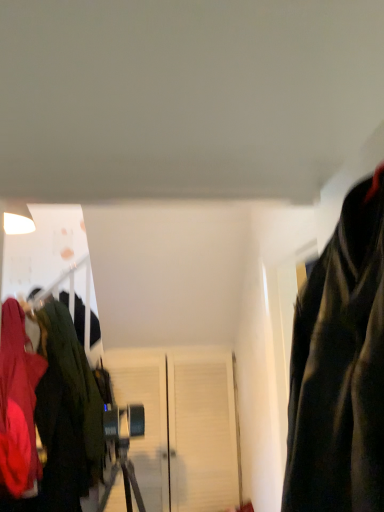
Question: From a real-world perspective, is velvet green jacket at left, which is counted as the first jacket, starting from the back, under white matte door at center?

Choices:
 (A) yes
 (B) no

Answer: (B)

Question: Considering the relative positions of velvet green jacket at left, the second jacket when ordered from front to back, and white matte door at center in the image provided, is velvet green jacket at left, the second jacket when ordered from front to back, to the left of white matte door at center from the viewer's perspective?

Choices:
 (A) no
 (B) yes

Answer: (B)

Question: Considering the relative sizes of velvet green jacket at left, which is counted as the first jacket, starting from the back, and white matte door at center in the image provided, is velvet green jacket at left, which is counted as the first jacket, starting from the back, wider than white matte door at center?

Choices:
 (A) yes
 (B) no

Answer: (A)

Question: Does velvet green jacket at left, the second jacket when ordered from front to back, have a lesser height compared to white matte door at center?

Choices:
 (A) no
 (B) yes

Answer: (A)

Question: Does velvet green jacket at left, the second jacket when ordered from front to back, come behind white matte door at center?

Choices:
 (A) no
 (B) yes

Answer: (A)

Question: In terms of height, does white matte door at center look taller or shorter compared to velvet green jacket at left, which is counted as the first jacket, starting from the back?

Choices:
 (A) tall
 (B) short

Answer: (B)

Question: Would you say white matte door at center is to the left or to the right of velvet green jacket at left, the second jacket when ordered from front to back, in the picture?

Choices:
 (A) left
 (B) right

Answer: (B)

Question: Does point 205,451 appear closer or farther from the camera than point 77,483?

Choices:
 (A) farther
 (B) closer

Answer: (A)

Question: Do you think white matte door at center is within velvet green jacket at left, the second jacket when ordered from front to back, or outside of it?

Choices:
 (A) inside
 (B) outside

Answer: (B)

Question: Is point (6, 330) positioned closer to the camera than point (64, 332)?

Choices:
 (A) farther
 (B) closer

Answer: (B)

Question: From the image's perspective, relative to velvet green jacket at left, the second jacket when ordered from front to back, is matte red jacket at left, which is counted as the first jacket, starting from the front, above or below?

Choices:
 (A) below
 (B) above

Answer: (B)

Question: From a real-world perspective, is matte red jacket at left, which is counted as the first jacket, starting from the front, physically located above or below velvet green jacket at left, the second jacket when ordered from front to back?

Choices:
 (A) below
 (B) above

Answer: (B)

Question: Visually, is matte red jacket at left, which is counted as the first jacket, starting from the front, positioned to the left or to the right of velvet green jacket at left, which is counted as the first jacket, starting from the back?

Choices:
 (A) left
 (B) right

Answer: (A)

Question: Is white matte door at center taller or shorter than matte red jacket at left, which is counted as the first jacket, starting from the front?

Choices:
 (A) short
 (B) tall

Answer: (A)

Question: From a real-world perspective, is white matte door at center physically located above or below matte red jacket at left, which is the 2th jacket in back-to-front order?

Choices:
 (A) below
 (B) above

Answer: (A)